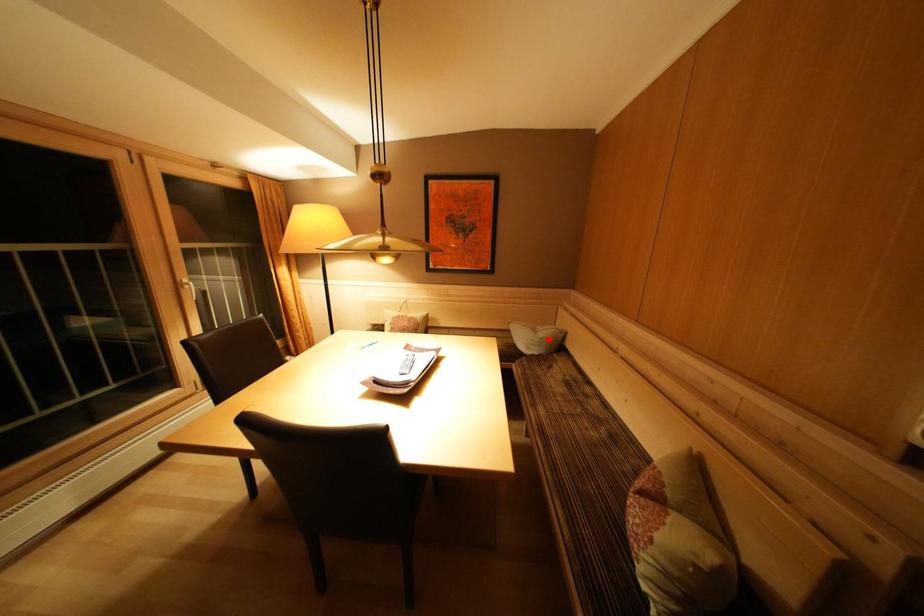
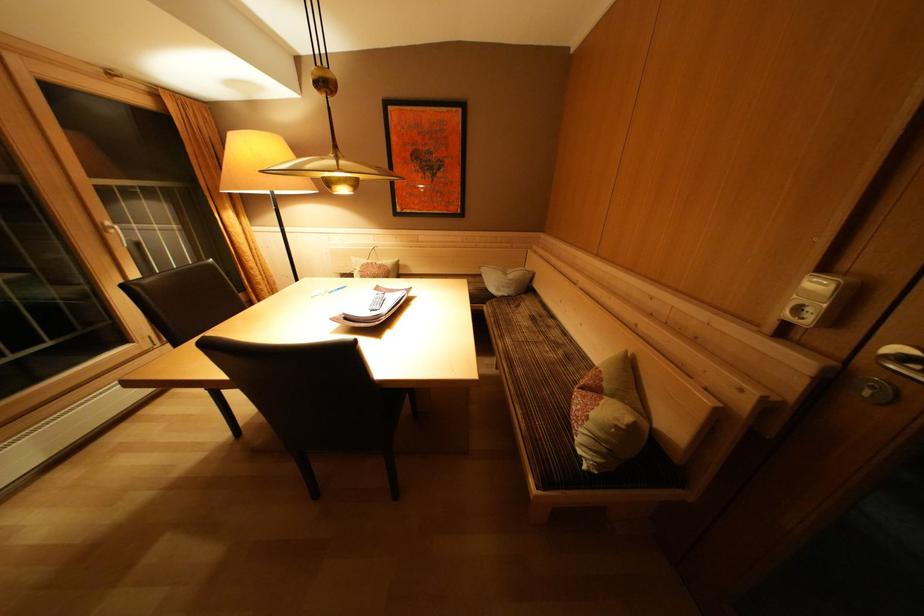
The point at the highlighted location is marked in the first image. Where is the corresponding point in the second image?

(517, 281)